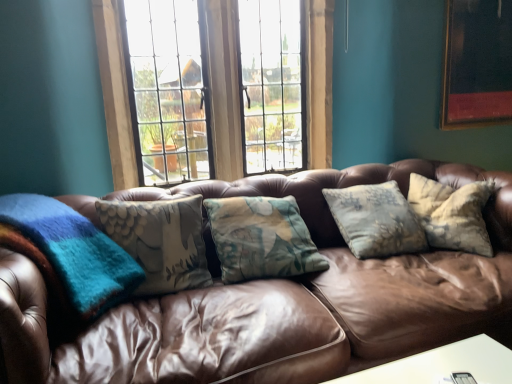
Question: From a real-world perspective, is wooden frame window at center beneath brown leather couch at center?

Choices:
 (A) no
 (B) yes

Answer: (A)

Question: Is wooden frame window at center further to the viewer compared to brown leather couch at center?

Choices:
 (A) no
 (B) yes

Answer: (B)

Question: Is brown leather couch at center located within wooden frame window at center?

Choices:
 (A) no
 (B) yes

Answer: (A)

Question: Is wooden frame window at center far away from brown leather couch at center?

Choices:
 (A) no
 (B) yes

Answer: (B)

Question: Are wooden frame window at center and brown leather couch at center beside each other?

Choices:
 (A) no
 (B) yes

Answer: (A)

Question: Can you confirm if wooden frame window at center is taller than brown leather couch at center?

Choices:
 (A) yes
 (B) no

Answer: (A)

Question: Is wooden frame window at center located outside wooden picture frame at upper right?

Choices:
 (A) no
 (B) yes

Answer: (B)

Question: Considering the relative sizes of wooden frame window at center and wooden picture frame at upper right in the image provided, is wooden frame window at center wider than wooden picture frame at upper right?

Choices:
 (A) yes
 (B) no

Answer: (A)

Question: Can you confirm if wooden frame window at center is positioned to the right of wooden picture frame at upper right?

Choices:
 (A) no
 (B) yes

Answer: (A)

Question: Does wooden frame window at center lie in front of wooden picture frame at upper right?

Choices:
 (A) no
 (B) yes

Answer: (B)

Question: Can you confirm if wooden frame window at center is taller than wooden picture frame at upper right?

Choices:
 (A) yes
 (B) no

Answer: (A)

Question: Considering the relative sizes of wooden frame window at center and wooden picture frame at upper right in the image provided, is wooden frame window at center bigger than wooden picture frame at upper right?

Choices:
 (A) yes
 (B) no

Answer: (A)

Question: From a real-world perspective, is wooden picture frame at upper right physically above brown leather couch at center?

Choices:
 (A) yes
 (B) no

Answer: (A)